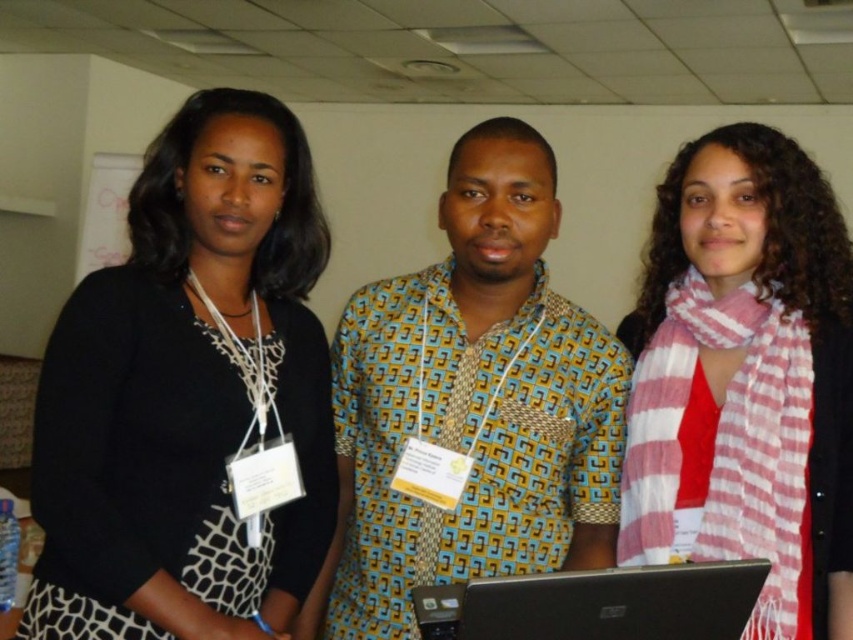
Question: Is black matte sweater at left behind yellow printed shirt at center?

Choices:
 (A) yes
 (B) no

Answer: (B)

Question: Which of the following is the farthest from the observer?

Choices:
 (A) (258, 108)
 (B) (578, 444)
 (C) (782, 403)

Answer: (B)

Question: Which object is positioned farthest from the pink striped scarf at center?

Choices:
 (A) black matte sweater at left
 (B) black plastic laptop at center

Answer: (A)

Question: Does black matte sweater at left have a smaller size compared to pink striped scarf at center?

Choices:
 (A) no
 (B) yes

Answer: (B)

Question: Can you confirm if black matte sweater at left is smaller than yellow printed shirt at center?

Choices:
 (A) yes
 (B) no

Answer: (A)

Question: Which is farther from the black matte sweater at left?

Choices:
 (A) yellow printed shirt at center
 (B) pink striped scarf at center
 (C) black plastic laptop at center

Answer: (B)